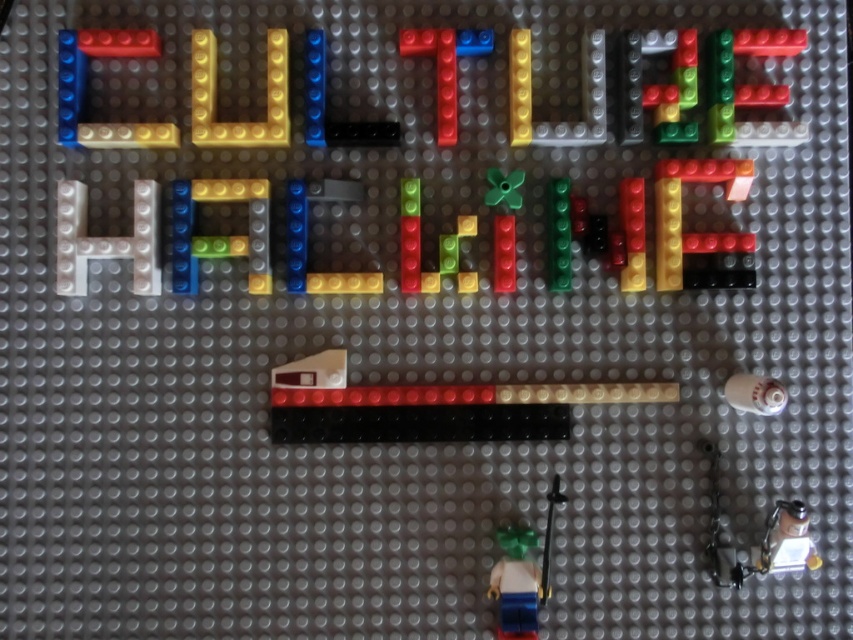
You are designing a LEGO set and need to place both the translucent yellow plastic at center and the translucent dark gray brick at center next to each other. Which one requires more horizontal space?

The translucent yellow plastic at center requires more horizontal space because its width is larger than the translucent dark gray brick at center.